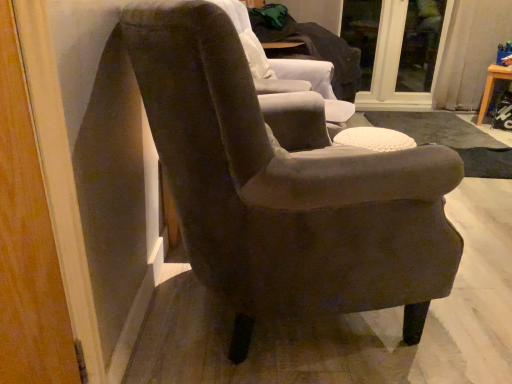
Question: Is wooden stool at right placed right next to transparent glass door at upper center, which appears as the second glass door when viewed from the right?

Choices:
 (A) yes
 (B) no

Answer: (B)

Question: Can you confirm if wooden stool at right is shorter than transparent glass door at upper center, which appears as the second glass door when viewed from the right?

Choices:
 (A) yes
 (B) no

Answer: (A)

Question: From a real-world perspective, is wooden stool at right on top of transparent glass door at upper center, which appears as the second glass door when viewed from the right?

Choices:
 (A) no
 (B) yes

Answer: (A)

Question: Does wooden stool at right have a lesser width compared to transparent glass door at upper center, which appears as the second glass door when viewed from the right?

Choices:
 (A) yes
 (B) no

Answer: (B)

Question: Is wooden stool at right wider than transparent glass door at upper center, which appears as the second glass door when viewed from the right?

Choices:
 (A) no
 (B) yes

Answer: (B)

Question: Is wooden stool at right behind transparent glass door at upper center, positioned as the first glass door in left-to-right order?

Choices:
 (A) yes
 (B) no

Answer: (B)

Question: Does wooden stool at right have a smaller size compared to transparent glass door at upper right, the 2th glass door from the left?

Choices:
 (A) no
 (B) yes

Answer: (A)

Question: From a real-world perspective, is wooden stool at right under transparent glass door at upper right, the 2th glass door from the left?

Choices:
 (A) no
 (B) yes

Answer: (B)

Question: From the image's perspective, is wooden stool at right over transparent glass door at upper right, acting as the first glass door starting from the right?

Choices:
 (A) yes
 (B) no

Answer: (B)

Question: From a real-world perspective, is wooden stool at right on top of transparent glass door at upper right, the 2th glass door from the left?

Choices:
 (A) yes
 (B) no

Answer: (B)

Question: Does wooden stool at right have a greater width compared to transparent glass door at upper right, acting as the first glass door starting from the right?

Choices:
 (A) yes
 (B) no

Answer: (A)

Question: Is transparent glass door at upper right, the 2th glass door from the left, located within wooden stool at right?

Choices:
 (A) no
 (B) yes

Answer: (A)

Question: From the image's perspective, is suede-like brown armchair at center, marked as the second chair in a back-to-front arrangement, on top of transparent glass door at upper center, positioned as the first glass door in left-to-right order?

Choices:
 (A) no
 (B) yes

Answer: (A)